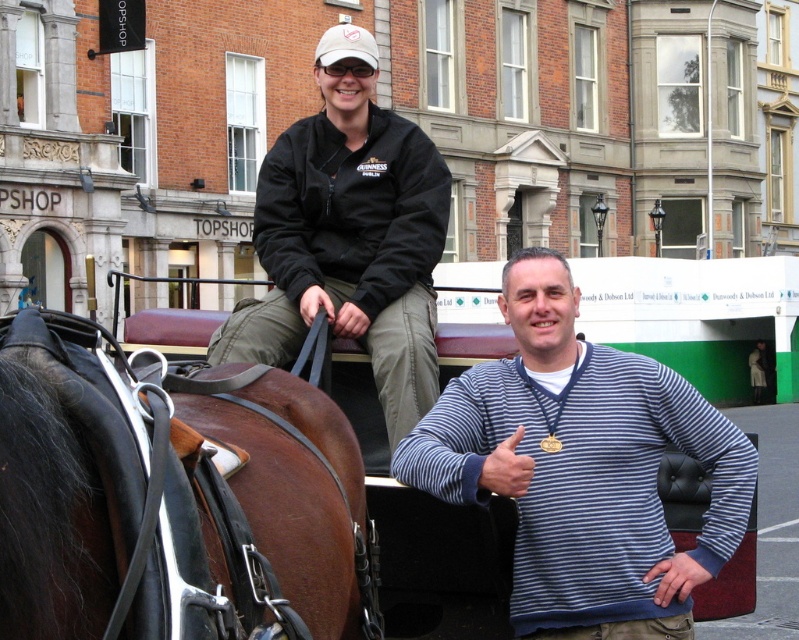
You are a photographer trying to capture a photo of the blue striped sweater at center and the brown leather saddle at upper left. If you want to ensure both items are fully visible in your frame, which object should you focus on first to avoid cropping?

Since the brown leather saddle at upper left is narrower than the blue striped sweater at center, you should focus on framing the blue striped sweater at center first to ensure it fits entirely within the photo, as it is wider and might require more space.